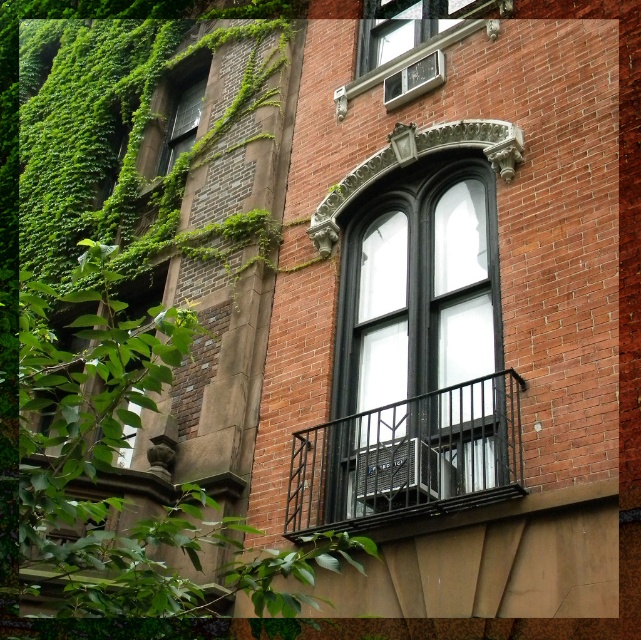
Question: Among these objects, which one is nearest to the camera?

Choices:
 (A) black metal balcony at center
 (B) green mossy wall at upper left
 (C) white glass window at upper center

Answer: (A)

Question: From the image, what is the correct spatial relationship of black glass window at center in relation to green mossy wall at upper left?

Choices:
 (A) right
 (B) left

Answer: (A)

Question: Does black metal balcony at center have a larger size compared to green mossy wall at upper left?

Choices:
 (A) yes
 (B) no

Answer: (A)

Question: Which of the following is the farthest from the observer?

Choices:
 (A) (417, 56)
 (B) (171, 86)
 (C) (360, 436)

Answer: (B)

Question: Can you confirm if black glass window at center is positioned to the left of black metal balcony at center?

Choices:
 (A) yes
 (B) no

Answer: (B)

Question: Which is nearer to the black metal balcony at center?

Choices:
 (A) black glass window at center
 (B) white glass window at upper center
 (C) green mossy wall at upper left

Answer: (A)